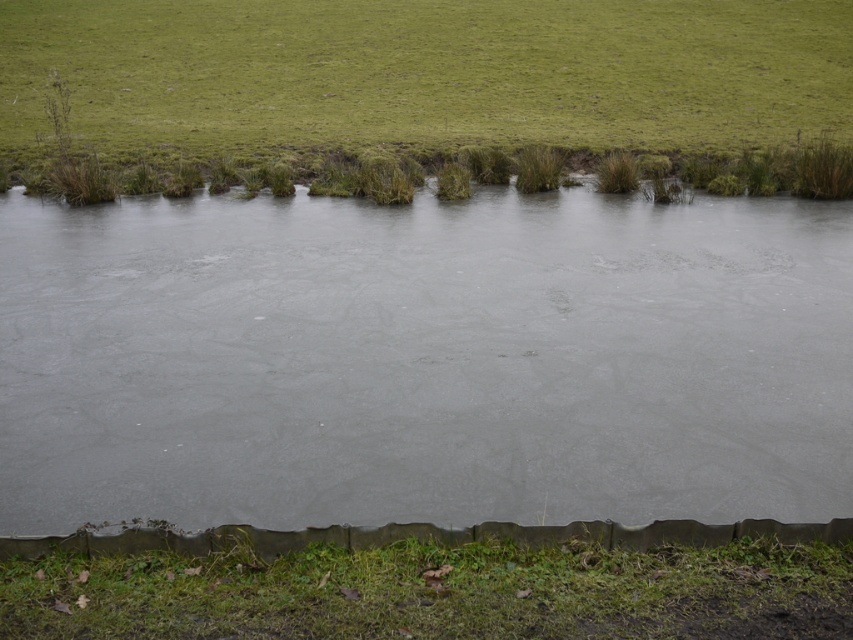
From the picture: You are standing on the green grassy at lower center and want to reach the gray matte water at center. Which direction should you move to get there?

The gray matte water at center is located above the green grassy at lower center, so you should move upward to reach it.

Based on the photo, you are a gardener who needs to plant flowers in both the green grassy at upper center and the green grassy at lower center. Since you have limited seeds, which area should you prioritize to cover more ground?

You should prioritize planting flowers in the green grassy at upper center because it is bigger than the green grassy at lower center, allowing for more coverage with the limited seeds.